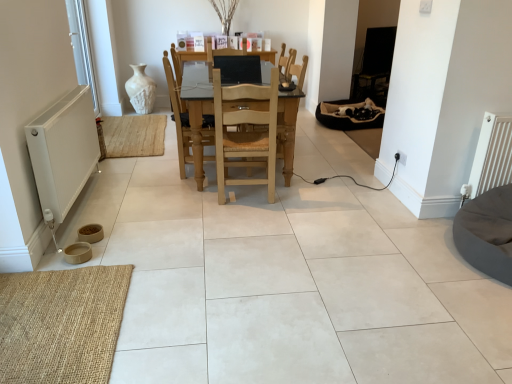
Find the location of a particular element. free point to the right of white matte radiator at lower left is located at coordinates (163, 216).